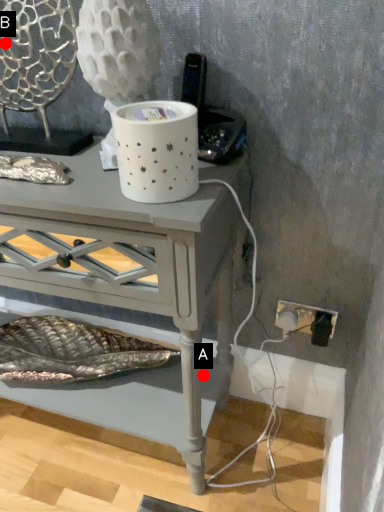
Question: Two points are circled on the image, labeled by A and B beside each circle. Which point is farther from the camera taking this photo?

Choices:
 (A) A is further
 (B) B is further

Answer: (A)